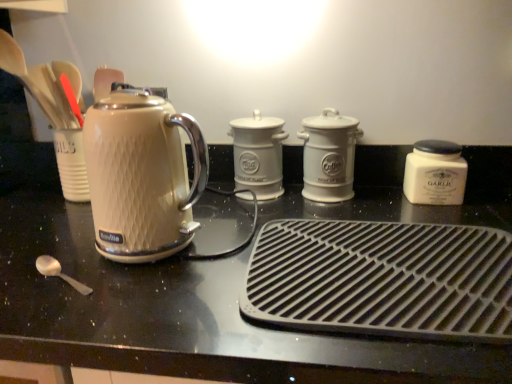
Where is `vacant space that is to the left of black rubber mat at center, placed as the fourth kitchen appliance when sorted from back to front`? This screenshot has width=512, height=384. vacant space that is to the left of black rubber mat at center, placed as the fourth kitchen appliance when sorted from back to front is located at coordinates (164, 295).